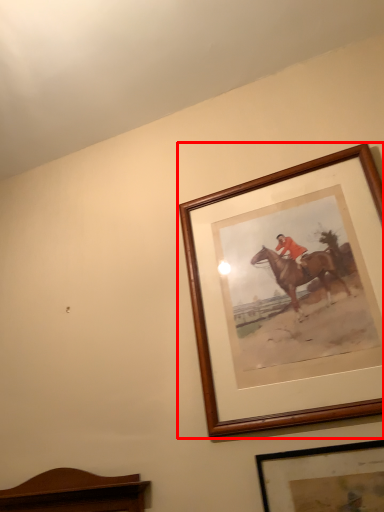
Question: Where is picture frame (annotated by the red box) located in relation to picture frame in the image?

Choices:
 (A) left
 (B) right

Answer: (A)